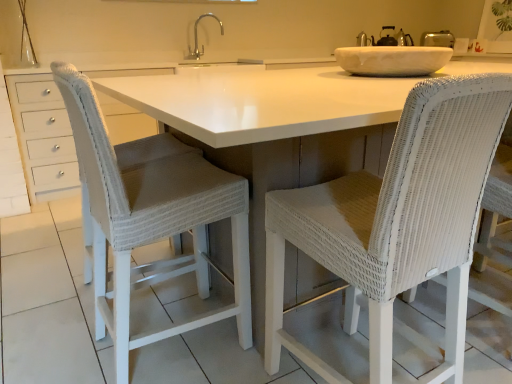
Question: Does white wicker chair at center, placed as the 2th chair when sorted from left to right, have a lesser height compared to white wicker chair at center, which is the 2th chair from right to left?

Choices:
 (A) yes
 (B) no

Answer: (A)

Question: From the image's perspective, would you say white wicker chair at center, placed as the 2th chair when sorted from left to right, is shown under white wicker chair at center, placed as the 1th chair when sorted from left to right?

Choices:
 (A) no
 (B) yes

Answer: (B)

Question: Is white wicker chair at center, placed as the 2th chair when sorted from left to right, not inside white wicker chair at center, placed as the 1th chair when sorted from left to right?

Choices:
 (A) no
 (B) yes

Answer: (B)

Question: Does white wicker chair at center, placed as the 2th chair when sorted from left to right, have a greater width compared to white wicker chair at center, placed as the 1th chair when sorted from left to right?

Choices:
 (A) no
 (B) yes

Answer: (A)

Question: Is white wicker chair at center, placed as the 2th chair when sorted from left to right, taller than white wicker chair at center, placed as the 1th chair when sorted from left to right?

Choices:
 (A) no
 (B) yes

Answer: (A)

Question: Choose the correct answer: Is silver metallic faucet at upper center inside white wicker chair at center, placed as the 2th chair when sorted from left to right, or outside it?

Choices:
 (A) outside
 (B) inside

Answer: (A)

Question: Relative to white wicker chair at center, the first chair in the right-to-left sequence, is silver metallic faucet at upper center in front or behind?

Choices:
 (A) front
 (B) behind

Answer: (B)

Question: In terms of height, does silver metallic faucet at upper center look taller or shorter compared to white wicker chair at center, placed as the 2th chair when sorted from left to right?

Choices:
 (A) tall
 (B) short

Answer: (B)

Question: From the image's perspective, is silver metallic faucet at upper center positioned above or below white wicker chair at center, placed as the 2th chair when sorted from left to right?

Choices:
 (A) below
 (B) above

Answer: (B)

Question: Is white wicker chair at center, placed as the 2th chair when sorted from left to right, bigger or smaller than silver metallic faucet at upper center?

Choices:
 (A) big
 (B) small

Answer: (A)

Question: Visually, is white wicker chair at center, the first chair in the right-to-left sequence, positioned to the left or to the right of silver metallic faucet at upper center?

Choices:
 (A) left
 (B) right

Answer: (B)

Question: From a real-world perspective, is white wicker chair at center, the first chair in the right-to-left sequence, physically located above or below silver metallic faucet at upper center?

Choices:
 (A) above
 (B) below

Answer: (B)

Question: Relative to silver metallic faucet at upper center, is white wicker chair at center, the first chair in the right-to-left sequence, in front or behind?

Choices:
 (A) behind
 (B) front

Answer: (B)

Question: Considering the positions of white wicker chair at center, which is the 2th chair from right to left, and silver metallic faucet at upper center in the image, is white wicker chair at center, which is the 2th chair from right to left, wider or thinner than silver metallic faucet at upper center?

Choices:
 (A) thin
 (B) wide

Answer: (B)

Question: Is white wicker chair at center, which is the 2th chair from right to left, bigger or smaller than silver metallic faucet at upper center?

Choices:
 (A) small
 (B) big

Answer: (B)